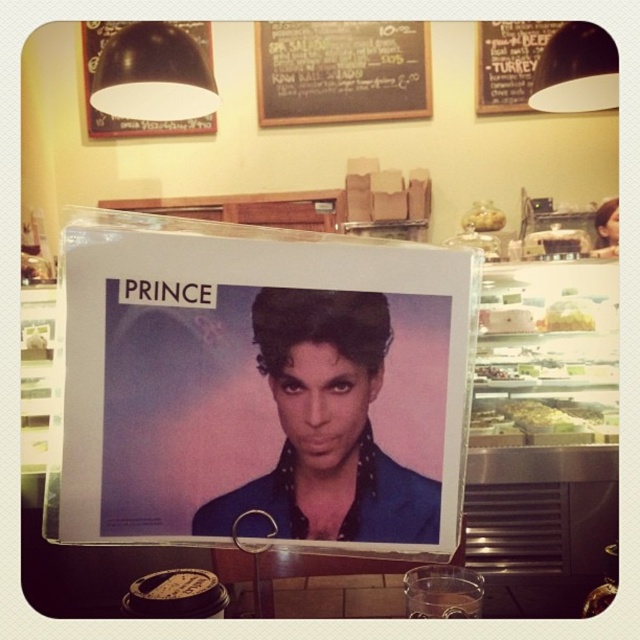
You are a customer in the deli and want to place an order. You see two points on the counter where you can place your order. The first point is at coordinate point(129, 81) and the second is at point(538, 416). Which point is closer to you?

Point(129, 81) is in front of point(538, 416), so it is closer to you.

You are a customer at the deli counter looking at the black matte bulletin board at upper left and the green leafy salad at center. Which item is located to the left of the other?

The black matte bulletin board at upper left is positioned on the left side of green leafy salad at center.